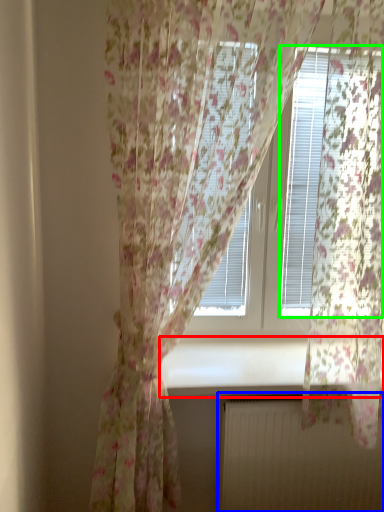
Question: Which object is the farthest from window sill (highlighted by a red box)? Choose among these: radiator (highlighted by a blue box) or blind (highlighted by a green box).

Choices:
 (A) radiator
 (B) blind

Answer: (B)